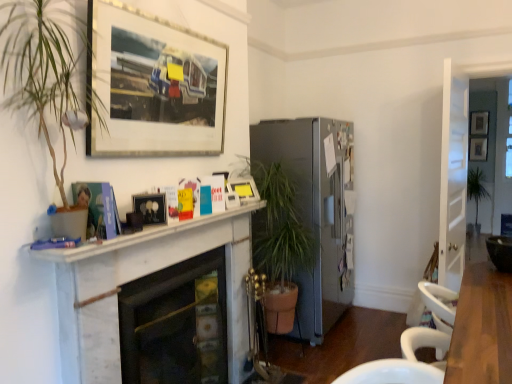
Question: Is matte black picture frame at center, which is counted as the 4th picture frame, starting from the back, shorter than white marble fireplace at center, arranged as the second fireplace when viewed from the front?

Choices:
 (A) yes
 (B) no

Answer: (A)

Question: From a real-world perspective, does matte black picture frame at center, which is the first picture frame in left-to-right order, sit lower than white marble fireplace at center, arranged as the second fireplace when viewed from the front?

Choices:
 (A) no
 (B) yes

Answer: (A)

Question: Can you confirm if matte black picture frame at center, the second picture frame viewed from the front, is thinner than white marble fireplace at center, the 2th fireplace when ordered from back to front?

Choices:
 (A) yes
 (B) no

Answer: (A)

Question: Does matte black picture frame at center, which is the first picture frame in left-to-right order, come behind white marble fireplace at center, the 2th fireplace when ordered from back to front?

Choices:
 (A) no
 (B) yes

Answer: (B)

Question: From the image's perspective, would you say matte black picture frame at center, the fifth picture frame viewed from the right, is positioned over white marble fireplace at center, arranged as the second fireplace when viewed from the front?

Choices:
 (A) yes
 (B) no

Answer: (A)

Question: In terms of width, does matte black picture frame at center, the fifth picture frame viewed from the right, look wider or thinner when compared to white marble fireplace at center, arranged as the second fireplace when viewed from the front?

Choices:
 (A) thin
 (B) wide

Answer: (A)

Question: Does point (144, 198) appear closer or farther from the camera than point (142, 276)?

Choices:
 (A) closer
 (B) farther

Answer: (A)

Question: Is matte black picture frame at center, the fifth picture frame viewed from the right, in front of or behind white marble fireplace at center, the 2th fireplace when ordered from back to front, in the image?

Choices:
 (A) front
 (B) behind

Answer: (B)

Question: Is matte black picture frame at center, which is the first picture frame in left-to-right order, situated inside white marble fireplace at center, the 2th fireplace when ordered from back to front, or outside?

Choices:
 (A) outside
 (B) inside

Answer: (A)

Question: Is matte silver picture frame at upper right, acting as the 2th picture frame starting from the back, wider or thinner than white glossy door at right?

Choices:
 (A) thin
 (B) wide

Answer: (A)

Question: In the image, is matte silver picture frame at upper right, the 2th picture frame in the right-to-left sequence, positioned in front of or behind white glossy door at right?

Choices:
 (A) behind
 (B) front

Answer: (A)

Question: Based on their positions, is matte silver picture frame at upper right, the fourth picture frame in the left-to-right sequence, located to the left or right of white glossy door at right?

Choices:
 (A) left
 (B) right

Answer: (B)

Question: In terms of size, does matte silver picture frame at upper right, the fourth picture frame in the left-to-right sequence, appear bigger or smaller than white glossy door at right?

Choices:
 (A) big
 (B) small

Answer: (B)

Question: In the image, is silver metallic picture frame at upper center, which is the fifth picture frame in back-to-front order, positioned in front of or behind green leafy plant at right?

Choices:
 (A) behind
 (B) front

Answer: (B)

Question: Is silver metallic picture frame at upper center, the fourth picture frame positioned from the right, inside the boundaries of green leafy plant at right, or outside?

Choices:
 (A) inside
 (B) outside

Answer: (B)